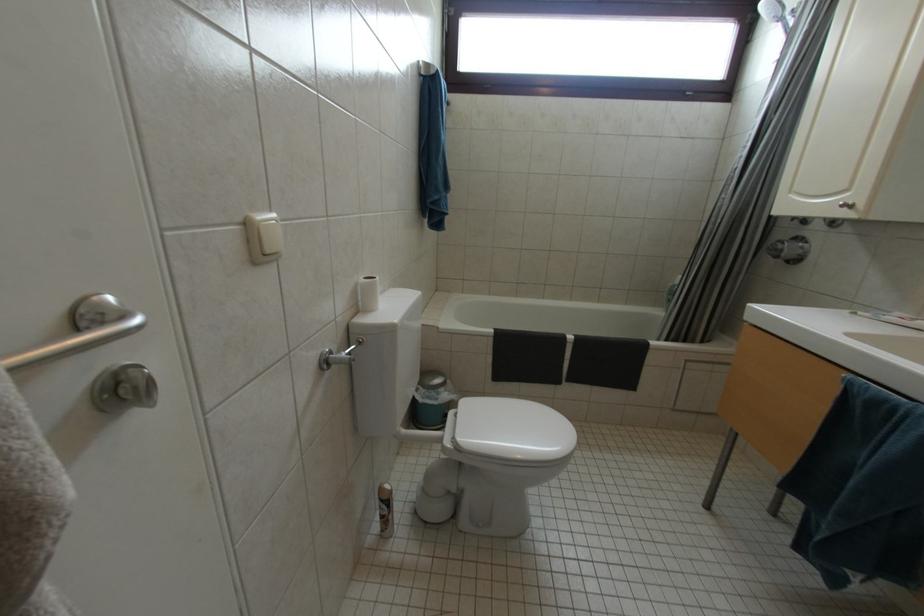
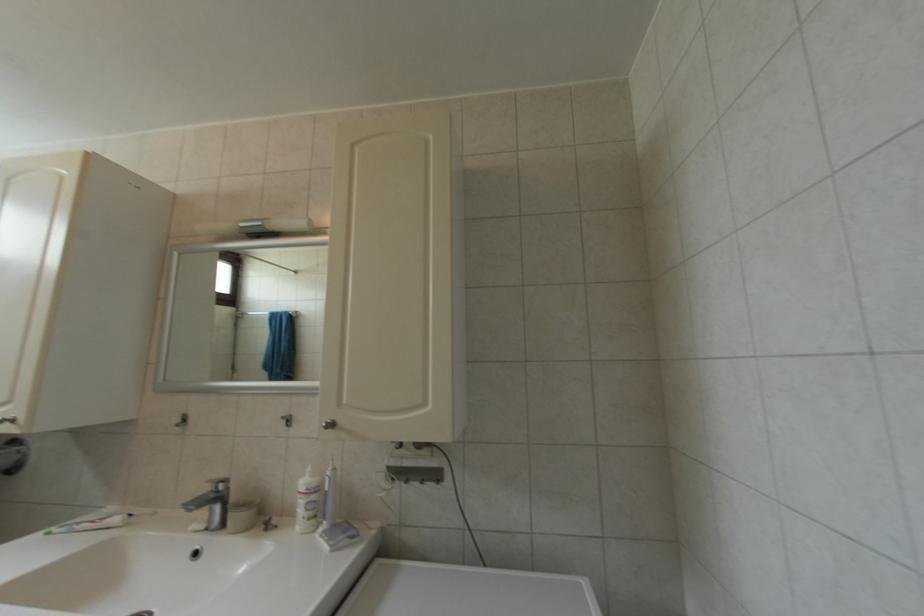
Question: The images are taken continuously from a first-person perspective. In which direction is your viewpoint rotating?

Choices:
 (A) Left
 (B) Right
 (C) Up
 (D) Down

Answer: (B)